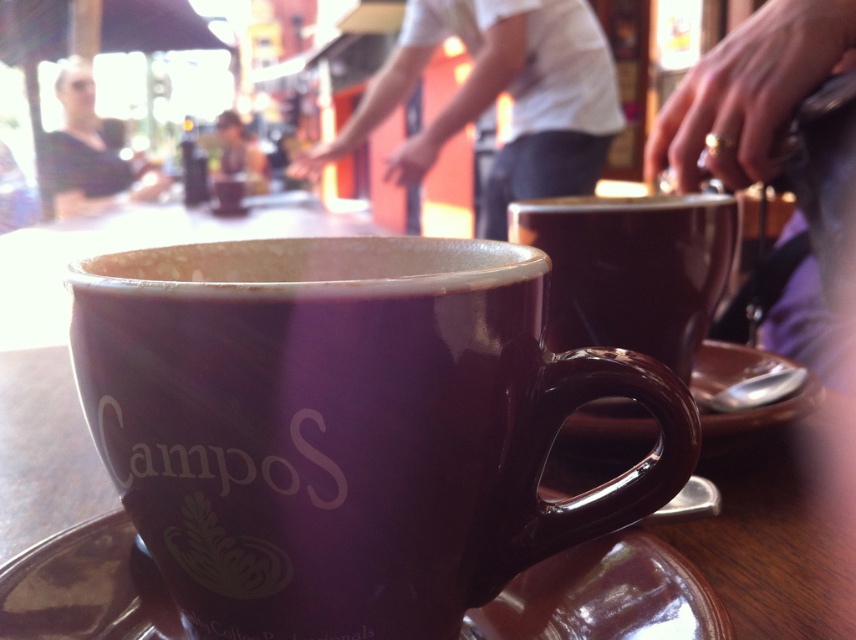
Question: Among these points, which one is nearest to the camera?

Choices:
 (A) (700, 376)
 (B) (494, 266)

Answer: (B)

Question: Observing the image, what is the correct spatial positioning of gold ring at upper right in reference to matte ceramic cup at center?

Choices:
 (A) left
 (B) right

Answer: (B)

Question: Which point is farther to the camera?

Choices:
 (A) [708, 266]
 (B) [652, 424]
 (C) [218, 244]

Answer: (A)

Question: Which point is farther to the camera?

Choices:
 (A) brown ceramic saucer at lower center
 (B) brown ceramic saucer at center
 (C) white cotton shirt at upper center
 (D) gold ring at upper right

Answer: (C)

Question: Is matte purple mug at center thinner than matte black shirt at upper left?

Choices:
 (A) no
 (B) yes

Answer: (B)

Question: Where is matte ceramic cup at center located in relation to brown ceramic saucer at center in the image?

Choices:
 (A) above
 (B) below

Answer: (A)